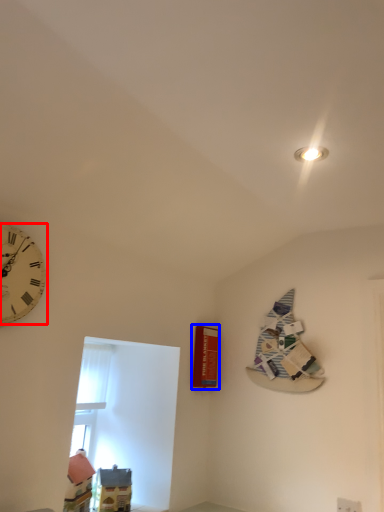
Question: Among these objects, which one is nearest to the camera, wall clock (highlighted by a red box) or magazine (highlighted by a blue box)?

Choices:
 (A) wall clock
 (B) magazine

Answer: (A)